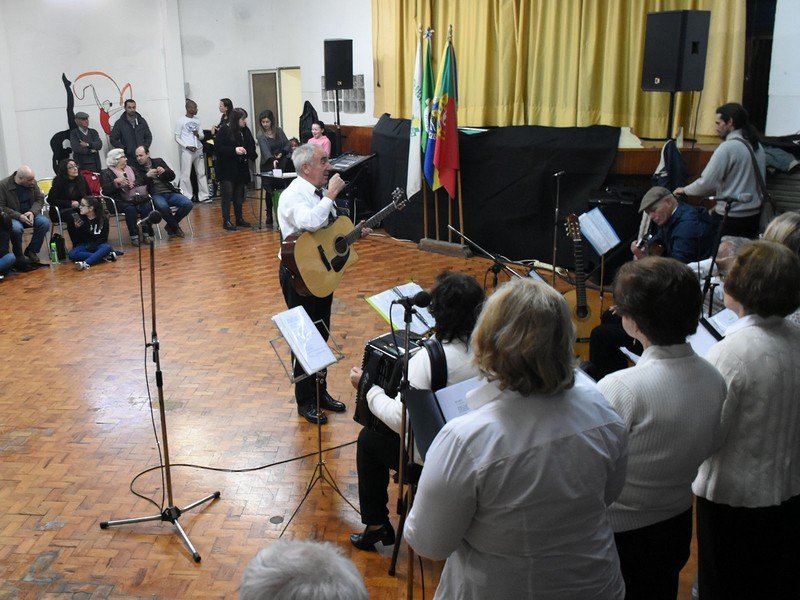
Locate an element on the screen. This screenshot has width=800, height=600. curtain is located at coordinates (493, 63), (562, 37), (734, 72), (684, 115), (402, 31).